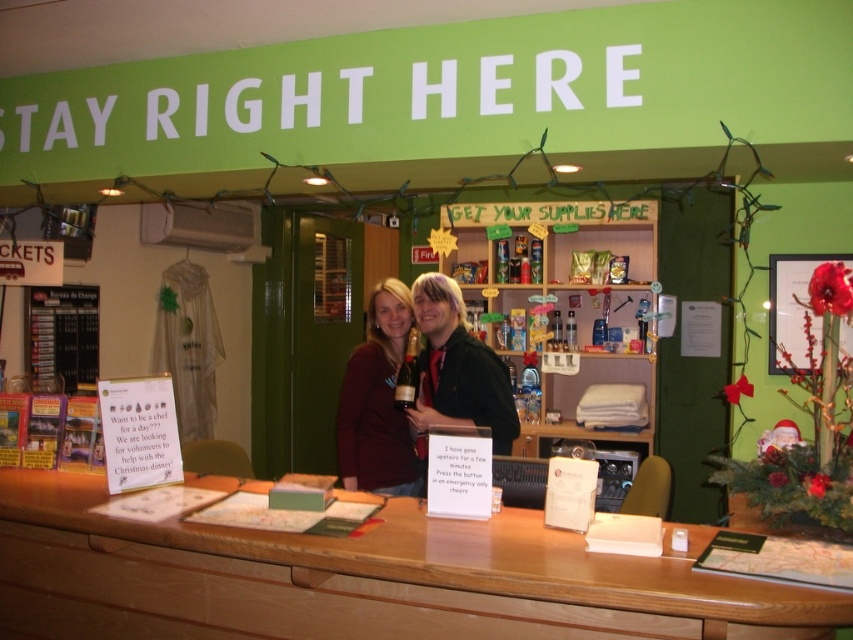
Based on the photo, can you confirm if wooden at center is positioned to the left of matte black sweater at center?

Correct, you'll find wooden at center to the left of matte black sweater at center.

The height and width of the screenshot is (640, 853). I want to click on wooden at center, so click(363, 579).

Where is `wooden at center`? The image size is (853, 640). wooden at center is located at coordinates (363, 579).

Between matte black bottle at center and matte black sweater at center, which one appears on the right side from the viewer's perspective?

matte black bottle at center

Does point (428, 413) come in front of point (392, 403)?

Yes, it is in front of point (392, 403).

Find the location of a particular element. Image resolution: width=853 pixels, height=640 pixels. matte black bottle at center is located at coordinates (456, 369).

Identify the location of matte black bottle at center. (456, 369).

Is wooden at center further to camera compared to matte black bottle at center?

No, it is not.

Is wooden at center thinner than matte black bottle at center?

No.

Is point (494, 531) positioned in front of point (352, 362)?

That is True.

What are the coordinates of `wooden at center` in the screenshot? It's located at (363, 579).